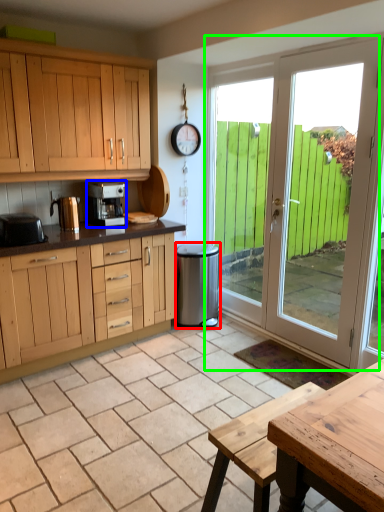
Question: Based on their relative distances, which object is nearer to appliance (highlighted by a red box)? Choose from kitchen appliance (highlighted by a blue box) and door (highlighted by a green box).

Choices:
 (A) kitchen appliance
 (B) door

Answer: (A)